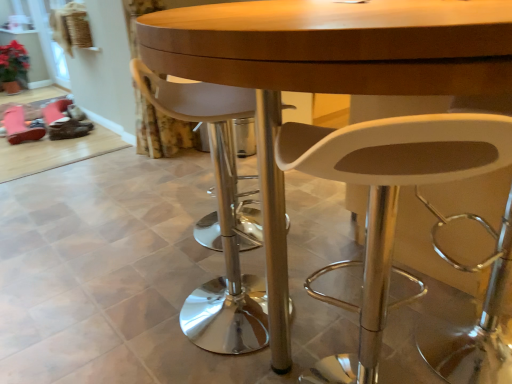
Question: Would you say transparent glass door at upper left is to the left or to the right of white plastic chair at center, placed as the 1th chair when sorted from right to left, in the picture?

Choices:
 (A) left
 (B) right

Answer: (A)

Question: Looking at their shapes, would you say transparent glass door at upper left is wider or thinner than white plastic chair at center, which appears as the second chair when viewed from the left?

Choices:
 (A) wide
 (B) thin

Answer: (B)

Question: Which is nearer to the white plastic stool at center, placed as the 1th chair when sorted from left to right?

Choices:
 (A) pink suede shoe at lower left
 (B) floral fabric curtain at lower left
 (C) matte wood table at center
 (D) brown leather shoe at lower left
 (E) transparent glass door at upper left

Answer: (C)

Question: Based on their relative distances, which object is nearer to the white plastic chair at center, placed as the 1th chair when sorted from right to left?

Choices:
 (A) brown leather shoe at lower left
 (B) white plastic stool at center, placed as the 1th chair when sorted from left to right
 (C) transparent glass door at upper left
 (D) pink suede shoe at lower left
 (E) floral fabric curtain at lower left

Answer: (B)